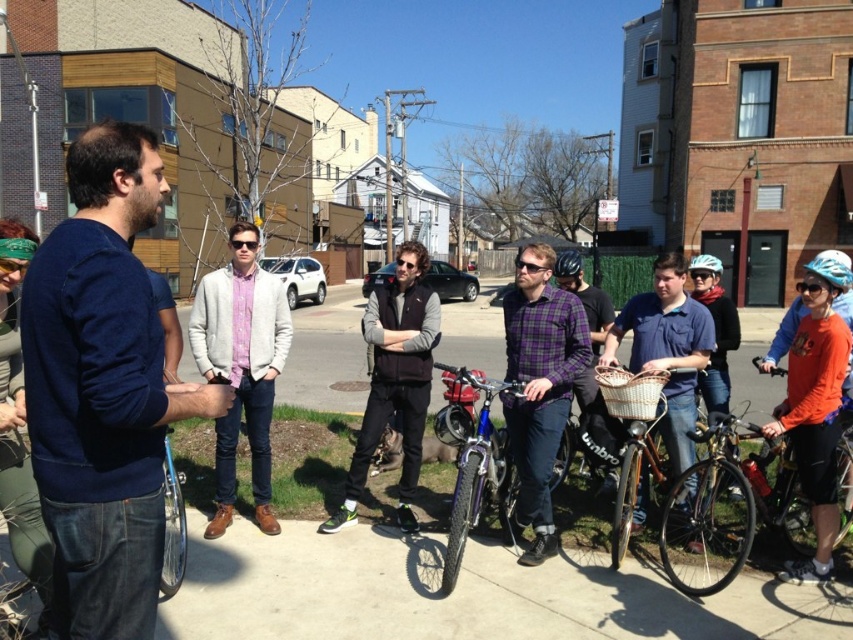
Question: Among these points, which one is farthest from the camera?

Choices:
 (A) 723,305
 (B) 549,348

Answer: (A)

Question: Can you confirm if purple plaid shirt at center is bigger than plaid fabric shirt at center?

Choices:
 (A) yes
 (B) no

Answer: (B)

Question: Is light gray wool sweater at center further to the viewer compared to blue matte bicycle helmet at upper right?

Choices:
 (A) yes
 (B) no

Answer: (A)

Question: Which object appears farthest from the camera in this image?

Choices:
 (A) matte purple shirt at center
 (B) white matte bicycle helmet at upper center
 (C) purple plaid shirt at center

Answer: (B)

Question: Considering the real-world distances, which object is farthest from the shiny metallic bicycle at center?

Choices:
 (A) matte blue shirt at center
 (B) gray concrete pavement at center

Answer: (B)

Question: In this image, where is gray concrete pavement at center located relative to shiny metallic bicycle at lower right?

Choices:
 (A) left
 (B) right

Answer: (A)